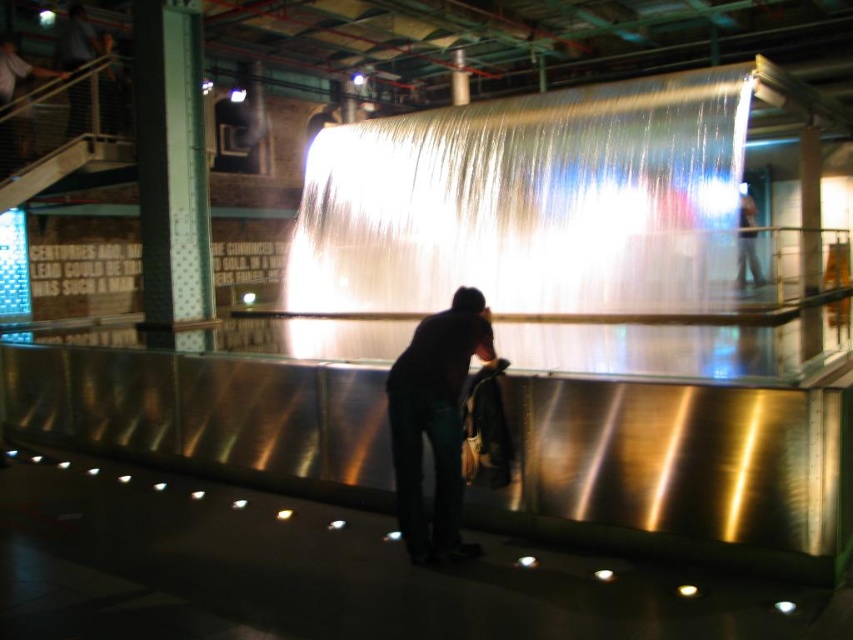
You are a photographer trying to capture the waterfall and the person in the scene. Since you want to include both the dark fabric bag at center and the dark blue jeans at upper right in your shot, which object should you focus on first to ensure they are both in frame?

You should focus on the dark blue jeans at upper right first because it is larger in size compared to the dark fabric bag at center, ensuring both fit within the frame.

You are standing in the indoor waterfall area and notice two items near you. You see the dark fabric bag at center and the dark blue jeans at upper right. Which item is positioned lower in the image?

The dark fabric bag at center is positioned below dark blue jeans at upper right, so the dark fabric bag at center is lower in the image.